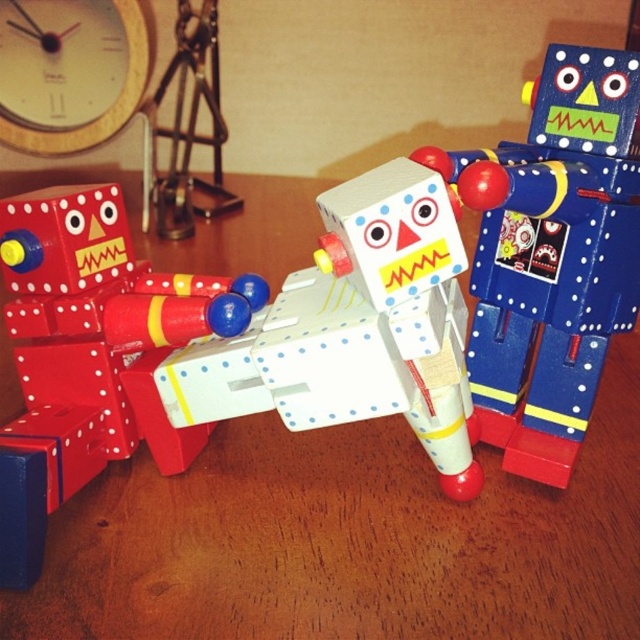
Question: Which point is closer to the camera?

Choices:
 (A) (93, 38)
 (B) (269, 360)

Answer: (B)

Question: Does blue matte robot at center appear over matte wooden robot at left?

Choices:
 (A) no
 (B) yes

Answer: (B)

Question: Which point is farther from the camera taking this photo?

Choices:
 (A) (128, 365)
 (B) (444, 380)
 (C) (67, 145)
 (D) (486, 150)

Answer: (C)

Question: Does white matte robot at center have a lesser width compared to matte wooden robot at left?

Choices:
 (A) no
 (B) yes

Answer: (A)

Question: Considering the real-world distances, which object is farthest from the blue matte robot at center?

Choices:
 (A) matte wooden robot at left
 (B) wooden clock at upper left

Answer: (B)

Question: Can you confirm if white matte robot at center is bigger than wooden clock at upper left?

Choices:
 (A) yes
 (B) no

Answer: (A)